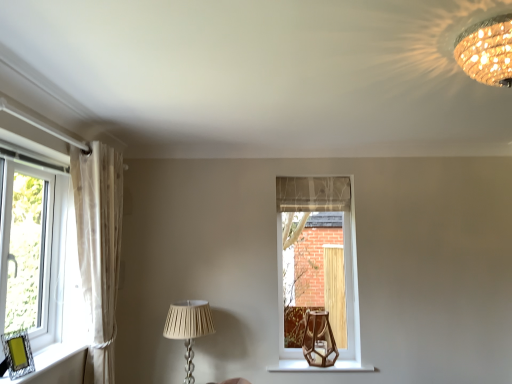
Measure the distance between white pleated fabric lampshade at lower center, positioned as the first lamp in bottom-to-top order, and camera.

The distance of white pleated fabric lampshade at lower center, positioned as the first lamp in bottom-to-top order, from camera is 9.24 feet.

Describe the element at coordinates (188, 327) in the screenshot. I see `white pleated fabric lampshade at lower center, arranged as the second lamp when viewed from the front` at that location.

At what (x,y) coordinates should I click in order to perform the action: click on brown glass table lamp at center. Please return your answer as a coordinate pair (x, y). Image resolution: width=512 pixels, height=384 pixels. Looking at the image, I should click on (319, 340).

Measure the distance between point (x=479, y=56) and camera.

Point (x=479, y=56) is 5.41 feet from camera.

The width and height of the screenshot is (512, 384). What are the coordinates of `sheer white curtain at left` in the screenshot? It's located at (99, 249).

This screenshot has width=512, height=384. In order to click on white pleated fabric lampshade at lower center, positioned as the 1th lamp in left-to-right order in this screenshot , I will do `click(188, 327)`.

This screenshot has height=384, width=512. In order to click on window that appears above the clear glass window at center, the first window when ordered from back to front (from a real-world perspective) in this screenshot , I will do `click(95, 240)`.

Which is in front, point (97, 352) or point (292, 182)?

Point (97, 352)

Is clear glass window at left, which is the second window in back-to-front order, wider than clear glass window at center, marked as the 1th window in a right-to-left arrangement?

In fact, clear glass window at left, which is the second window in back-to-front order, might be narrower than clear glass window at center, marked as the 1th window in a right-to-left arrangement.

From the image's perspective, who appears lower, clear glass window at center, marked as the 1th window in a right-to-left arrangement, or white pleated fabric lampshade at lower center, marked as the second lamp in a right-to-left arrangement?

white pleated fabric lampshade at lower center, marked as the second lamp in a right-to-left arrangement, appears lower in the image.

Where is `the 1st window above the white pleated fabric lampshade at lower center, the first lamp positioned from the back (from the image's perspective)`? The width and height of the screenshot is (512, 384). the 1st window above the white pleated fabric lampshade at lower center, the first lamp positioned from the back (from the image's perspective) is located at coordinates (317, 268).

From a real-world perspective, is clear glass window at center, marked as the 1th window in a right-to-left arrangement, on top of white pleated fabric lampshade at lower center, marked as the second lamp in a right-to-left arrangement?

Indeed, from a real-world perspective, clear glass window at center, marked as the 1th window in a right-to-left arrangement, stands above white pleated fabric lampshade at lower center, marked as the second lamp in a right-to-left arrangement.

From the image's perspective, which is above, brown glass table lamp at center or clear glass window at left, which is the second window in back-to-front order?

clear glass window at left, which is the second window in back-to-front order.

Find the location of a particular element. The image size is (512, 384). table lamp that appears below the clear glass window at left, which is the second window in back-to-front order (from a real-world perspective) is located at coordinates (319, 340).

Looking at this image, considering the relative positions of brown glass table lamp at center and clear glass window at left, which is the second window in back-to-front order, in the image provided, is brown glass table lamp at center to the left of clear glass window at left, which is the second window in back-to-front order, from the viewer's perspective?

No.

Does brown glass table lamp at center have a greater height compared to clear glass window at left, which ranks as the first window in left-to-right order?

No, brown glass table lamp at center is not taller than clear glass window at left, which ranks as the first window in left-to-right order.

Is clear glass window at left, which is the second window in back-to-front order, bigger or smaller than wooden hexagonal vase at lower center?

Clearly, clear glass window at left, which is the second window in back-to-front order, is larger in size than wooden hexagonal vase at lower center.

In the scene shown: From a real-world perspective, is clear glass window at left, which is the second window in back-to-front order, located beneath wooden hexagonal vase at lower center?

No.

Would you say clear glass window at left, placed as the 2th window when sorted from right to left, is inside or outside wooden hexagonal vase at lower center?

The correct answer is: outside.

From the image's perspective, would you say clear glass window at left, placed as the 2th window when sorted from right to left, is shown under wooden hexagonal vase at lower center?

No, from the image's perspective, clear glass window at left, placed as the 2th window when sorted from right to left, is not beneath wooden hexagonal vase at lower center.

Is clear glass window at left, which ranks as the first window in left-to-right order, not near gold textured chandelier at upper right, marked as the 2th lamp in a left-to-right arrangement?

Indeed, clear glass window at left, which ranks as the first window in left-to-right order, is not near gold textured chandelier at upper right, marked as the 2th lamp in a left-to-right arrangement.

Is clear glass window at left, which ranks as the first window in left-to-right order, not within gold textured chandelier at upper right, the 2th lamp when ordered from back to front?

Yes.

Based on the photo, which point is more distant from viewer, (103, 252) or (488, 26)?

The point (103, 252) is more distant.

Considering the relative sizes of clear glass window at left, placed as the 2th window when sorted from right to left, and gold textured chandelier at upper right, marked as the 2th lamp in a left-to-right arrangement, in the image provided, is clear glass window at left, placed as the 2th window when sorted from right to left, bigger than gold textured chandelier at upper right, marked as the 2th lamp in a left-to-right arrangement,?

Correct, clear glass window at left, placed as the 2th window when sorted from right to left, is larger in size than gold textured chandelier at upper right, marked as the 2th lamp in a left-to-right arrangement.

Which object is more forward, sheer white curtain at left or brown glass table lamp at center?

sheer white curtain at left is in front.

Is sheer white curtain at left directly adjacent to brown glass table lamp at center?

No, sheer white curtain at left is not making contact with brown glass table lamp at center.

Considering the relative positions of sheer white curtain at left and brown glass table lamp at center in the image provided, is sheer white curtain at left to the left of brown glass table lamp at center from the viewer's perspective?

Yes.

Is sheer white curtain at left wider or thinner than brown glass table lamp at center?

Considering their sizes, sheer white curtain at left looks slimmer than brown glass table lamp at center.

From a real-world perspective, between brown glass table lamp at center and gold textured chandelier at upper right, positioned as the first lamp in right-to-left order, who is vertically higher?

gold textured chandelier at upper right, positioned as the first lamp in right-to-left order, is physically above.

Is point (316, 362) positioned behind point (486, 38)?

Yes.

Which of these two, brown glass table lamp at center or gold textured chandelier at upper right, which appears as the 2th lamp when ordered from the bottom, is wider?

Wider between the two is gold textured chandelier at upper right, which appears as the 2th lamp when ordered from the bottom.

This screenshot has width=512, height=384. I want to click on window that appears above the clear glass window at center, marked as the 1th window in a right-to-left arrangement (from a real-world perspective), so click(95, 240).

Where is `the 1st window above the white pleated fabric lampshade at lower center, positioned as the 1th lamp in left-to-right order (from the image's perspective)`? The image size is (512, 384). the 1st window above the white pleated fabric lampshade at lower center, positioned as the 1th lamp in left-to-right order (from the image's perspective) is located at coordinates (317, 268).

Which object lies further to the anchor point brown glass table lamp at center, clear glass window at center, arranged as the 2th window when viewed from the left, or wooden hexagonal vase at lower center?

The object further to brown glass table lamp at center is clear glass window at center, arranged as the 2th window when viewed from the left.

From the image, which object appears to be nearer to brown glass table lamp at center, gold textured chandelier at upper right, the 1th lamp viewed from the front, or clear glass window at left, placed as the 2th window when sorted from right to left?

The object closer to brown glass table lamp at center is clear glass window at left, placed as the 2th window when sorted from right to left.

Estimate the real-world distances between objects in this image. Which object is further from white pleated fabric lampshade at lower center, arranged as the second lamp when viewed from the front, gold textured chandelier at upper right, marked as the 2th lamp in a left-to-right arrangement, or clear glass window at center, arranged as the 2th window when viewed from the left?

Based on the image, gold textured chandelier at upper right, marked as the 2th lamp in a left-to-right arrangement, appears to be further to white pleated fabric lampshade at lower center, arranged as the second lamp when viewed from the front.

From the image, which object appears to be farther from brown glass table lamp at center, wooden hexagonal vase at lower center or clear glass window at left, placed as the 2th window when sorted from right to left?

Based on the image, clear glass window at left, placed as the 2th window when sorted from right to left, appears to be further to brown glass table lamp at center.

Estimate the real-world distances between objects in this image. Which object is closer to brown glass table lamp at center, clear glass window at left, which ranks as the first window in left-to-right order, or gold textured chandelier at upper right, marked as the 2th lamp in a left-to-right arrangement?

Among the two, clear glass window at left, which ranks as the first window in left-to-right order, is located nearer to brown glass table lamp at center.

From the image, which object appears to be nearer to white pleated fabric lampshade at lower center, positioned as the first lamp in bottom-to-top order, sheer white curtain at left or brown glass table lamp at center?

Based on the image, sheer white curtain at left appears to be nearer to white pleated fabric lampshade at lower center, positioned as the first lamp in bottom-to-top order.

In the scene shown: From the image, which object appears to be nearer to gold textured chandelier at upper right, the 1th lamp viewed from the front, brown glass table lamp at center or white pleated fabric lampshade at lower center, positioned as the first lamp in bottom-to-top order?

Based on the image, white pleated fabric lampshade at lower center, positioned as the first lamp in bottom-to-top order, appears to be nearer to gold textured chandelier at upper right, the 1th lamp viewed from the front.

Based on their spatial positions, is white pleated fabric lampshade at lower center, arranged as the 2th lamp when viewed from the top, or sheer white curtain at left closer to gold textured chandelier at upper right, the 1th lamp viewed from the front?

Based on the image, sheer white curtain at left appears to be nearer to gold textured chandelier at upper right, the 1th lamp viewed from the front.

Locate an element on the screen. window between white pleated fabric lampshade at lower center, the first lamp positioned from the back, and wooden hexagonal vase at lower center, in the horizontal direction is located at coordinates (317, 268).

You are a GUI agent. You are given a task and a screenshot of the screen. Output one action in this format:
    pyautogui.click(x=<x>, y=<y>)
    Task: Click on the lamp between clear glass window at left, which ranks as the first window in left-to-right order, and gold textured chandelier at upper right, acting as the 1th lamp starting from the top, in the horizontal direction
    The height and width of the screenshot is (384, 512).
    Given the screenshot: What is the action you would take?
    pyautogui.click(x=188, y=327)

This screenshot has width=512, height=384. In order to click on window situated between sheer white curtain at left and gold textured chandelier at upper right, marked as the 2th lamp in a left-to-right arrangement, from left to right in this screenshot , I will do `click(317, 268)`.

In order to click on curtain located between clear glass window at left, the 1th window from the front, and wooden hexagonal vase at lower center in the left-right direction in this screenshot , I will do `click(99, 249)`.